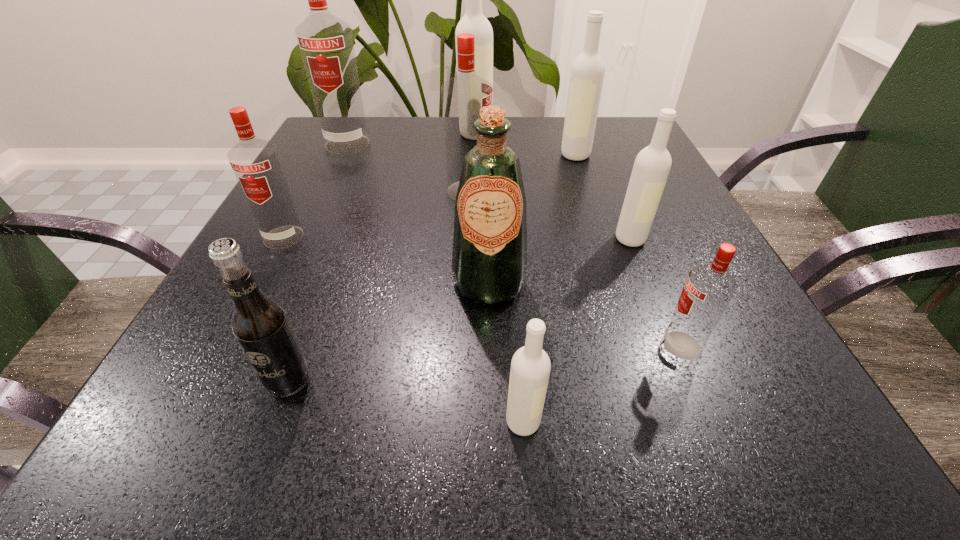
Where is `object that is at the near left corner`? The height and width of the screenshot is (540, 960). object that is at the near left corner is located at coordinates (260, 325).

Where is `object that is positioned at the far right corner`? The width and height of the screenshot is (960, 540). object that is positioned at the far right corner is located at coordinates (587, 72).

Identify the location of vacant space at the far edge of the desktop. (535, 146).

The image size is (960, 540). Identify the location of blank space at the left edge of the desktop. (363, 173).

The image size is (960, 540). In the image, there is a desktop. What are the coordinates of `vacant space at the right edge` in the screenshot? It's located at (785, 379).

The image size is (960, 540). I want to click on free space at the far left corner of the desktop, so click(352, 158).

You are a GUI agent. You are given a task and a screenshot of the screen. Output one action in this format:
    pyautogui.click(x=<x>, y=<y>)
    Task: Click on the vacant space at the near left corner of the desktop
    This screenshot has height=540, width=960.
    Given the screenshot: What is the action you would take?
    pyautogui.click(x=135, y=442)

The image size is (960, 540). In the image, there is a desktop. Find the location of `vacant space at the far right corner`. vacant space at the far right corner is located at coordinates (598, 117).

Locate an element on the screen. The height and width of the screenshot is (540, 960). vacant area that lies between the seventh farthest vodka and the fourth nearest object is located at coordinates (586, 314).

Where is `vacant space in between the third farthest white vodka and the farthest white vodka`? This screenshot has height=540, width=960. vacant space in between the third farthest white vodka and the farthest white vodka is located at coordinates (553, 186).